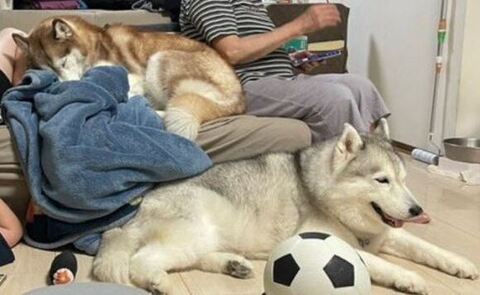
At what (x,y) coordinates should I click in order to perform the action: click on blanket. Please return your answer as a coordinate pair (x, y). This screenshot has height=295, width=480. Looking at the image, I should click on (91, 144).